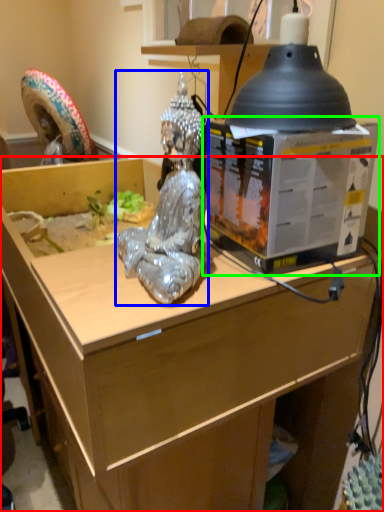
Question: Estimate the real-world distances between objects in this image. Which object is closer to desk (highlighted by a red box), person (highlighted by a blue box) or box (highlighted by a green box)?

Choices:
 (A) person
 (B) box

Answer: (B)